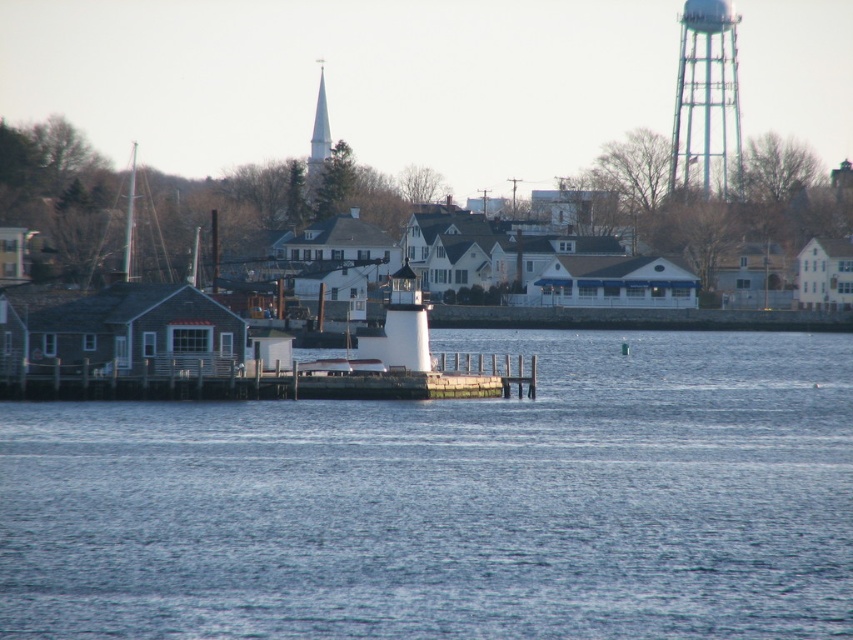
You are a bird flying over the waterfront scene. You want to land on the tallest structure between the metallic lattice tower at upper right and the white matte water tower at center. Which one should you choose?

The metallic lattice tower at upper right is taller than the white matte water tower at center, so you should land on the metallic lattice tower at upper right.

You are a photographer planning to capture the waterfront scene. You want to ensure both the white wooden dock at center and the white steeple at upper center are clearly visible in your shot. Based on their sizes in the image, which object should you focus on to ensure both are in frame without cropping?

The white wooden dock at center occupies less space than the white steeple at upper center. To ensure both are in frame without cropping, focus on the larger object, the white steeple at upper center, as it takes up more space and will help frame the smaller dock.